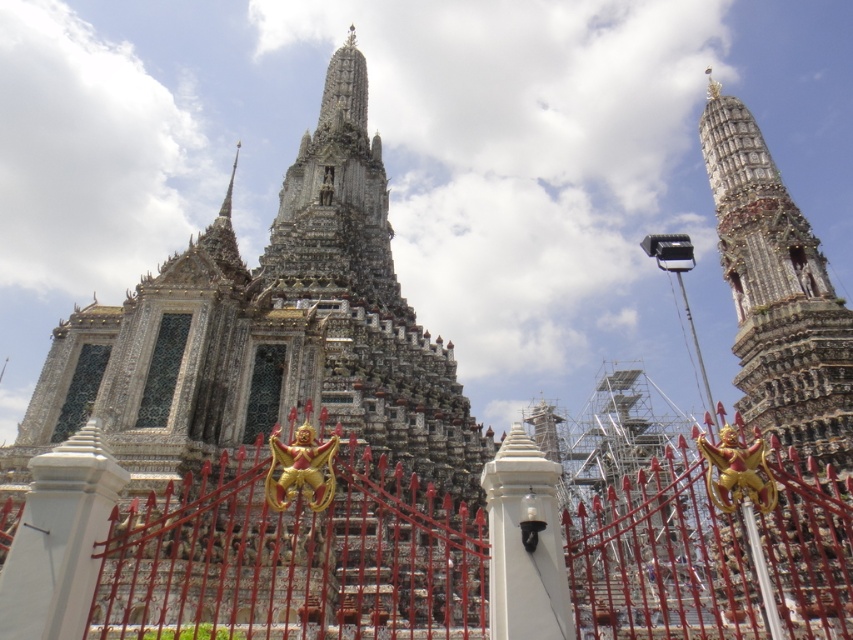
Question: Where is carved stone spire at upper right located in relation to white glossy pillar at center in the image?

Choices:
 (A) above
 (B) below

Answer: (A)

Question: Does white stone pillar at center have a larger size compared to white glossy pillar at center?

Choices:
 (A) no
 (B) yes

Answer: (B)

Question: Which is nearer to the white glossy pillar at center?

Choices:
 (A) red metal gate at center
 (B) carved stone spire at upper right

Answer: (A)

Question: Is red metal gate at center positioned in front of carved stone spire at upper right?

Choices:
 (A) yes
 (B) no

Answer: (A)

Question: Which of the following is the closest to the observer?

Choices:
 (A) white glossy pillar at center
 (B) white stone pillar at center
 (C) red metal gate at center
 (D) carved stone spire at upper right

Answer: (B)

Question: Among these objects, which one is nearest to the camera?

Choices:
 (A) white stone pillar at center
 (B) white glossy pillar at center

Answer: (A)